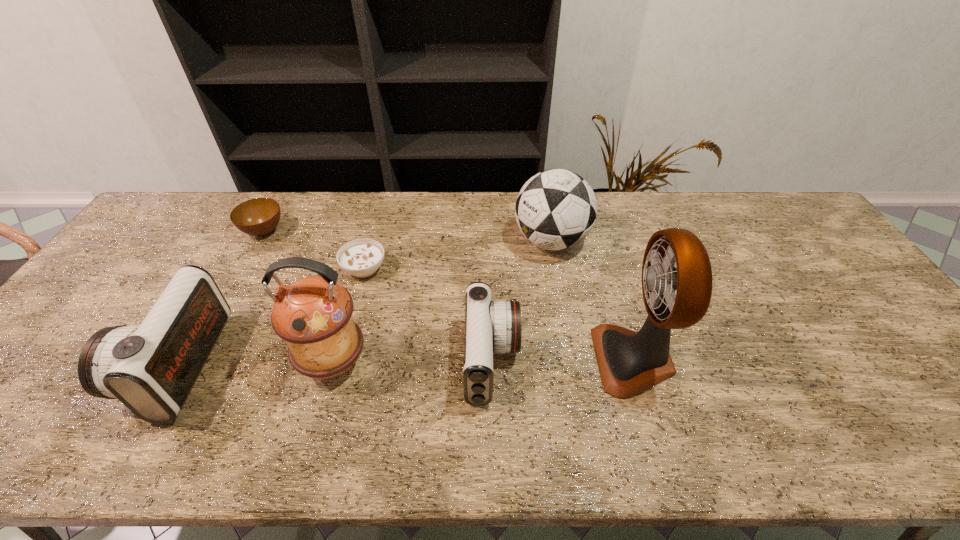
Where is `the fourth shortest object`? The width and height of the screenshot is (960, 540). the fourth shortest object is located at coordinates (151, 368).

Find the location of a particular element. The height and width of the screenshot is (540, 960). the left camcorder is located at coordinates (151, 368).

Locate an element on the screen. the right camcorder is located at coordinates (491, 327).

The width and height of the screenshot is (960, 540). I want to click on the third shortest object, so click(491, 327).

Find the location of a particular element. the third tallest object is located at coordinates [x=556, y=209].

Find the location of a particular element. Image resolution: width=960 pixels, height=540 pixels. bowl is located at coordinates (258, 217).

The image size is (960, 540). In order to click on fan in this screenshot , I will do `click(630, 363)`.

This screenshot has width=960, height=540. I want to click on soup bowl, so click(362, 257).

At what (x,y) coordinates should I click in order to perform the action: click on oil lamp. Please return your answer as a coordinate pair (x, y). The height and width of the screenshot is (540, 960). Looking at the image, I should click on point(313,314).

Where is `vacant space situated 0.090m on the surface of the left camcorder`? vacant space situated 0.090m on the surface of the left camcorder is located at coordinates (108, 364).